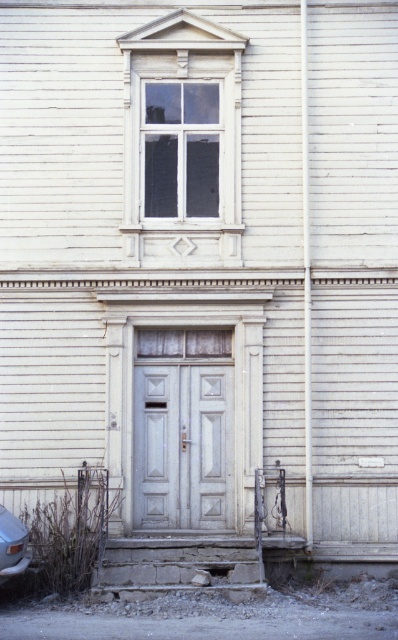
Question: Which point is closer to the camera?

Choices:
 (A) white wood window at upper center
 (B) white matte door at center
 (C) silver metallic car at lower left

Answer: (C)

Question: Can you confirm if white wood window at upper center is thinner than white glass window at upper center?

Choices:
 (A) yes
 (B) no

Answer: (B)

Question: Is white wood window at upper center positioned behind white matte door at center?

Choices:
 (A) yes
 (B) no

Answer: (B)

Question: Which object is positioned closest to the silver metallic car at lower left?

Choices:
 (A) white matte door at center
 (B) white glass window at upper center

Answer: (A)

Question: Which point appears closest to the camera in this image?

Choices:
 (A) (171, 472)
 (B) (140, 48)

Answer: (A)

Question: Is white wood window at upper center wider than white matte door at center?

Choices:
 (A) yes
 (B) no

Answer: (A)